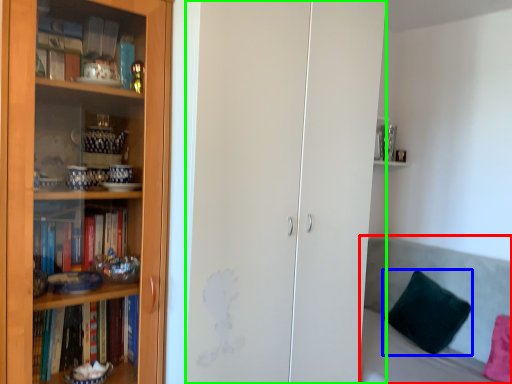
Question: Considering the real-world distances, which object is closest to couch (highlighted by a red box)? pillow (highlighted by a blue box) or glass door (highlighted by a green box).

Choices:
 (A) pillow
 (B) glass door

Answer: (A)